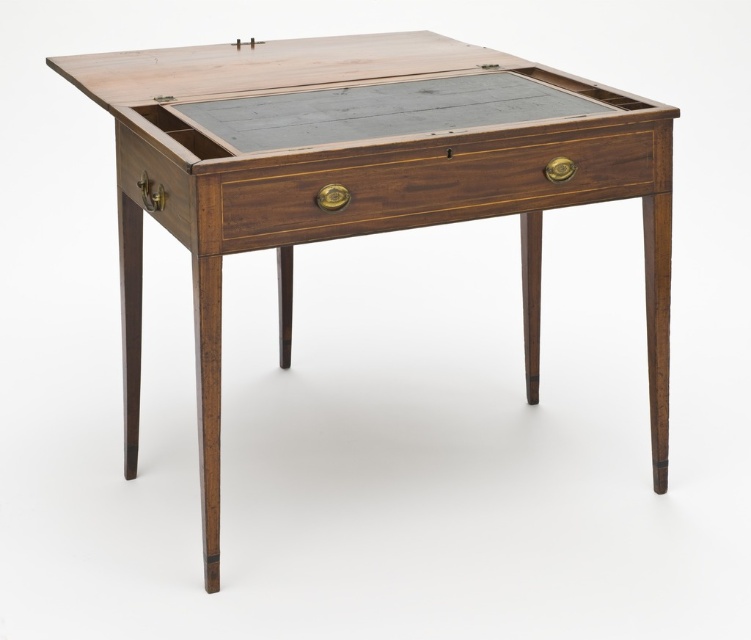
You are organizing your desk and need to place a 12 inch ruler between the mahogany drawer at center and the mahogany wood drawer at left. Can the ruler fit between them without overlapping either drawer?

The distance between the mahogany drawer at center and mahogany wood drawer at left is 11.52 inches, which is less than the 12 inch ruler. Therefore, the ruler cannot fit between them without overlapping either drawer.

You are organizing a small antique shop and need to place a 25 cm wide decorative vase between the mahogany wood table at center and the mahogany wood drawer at left. Will there be enough space for the vase between them?

The distance between the mahogany wood table at center and the mahogany wood drawer at left is 26.58 centimeters. Since the vase is 25 cm wide, there will be enough space as 26.58 cm is greater than 25 cm.

In the scene shown: You are standing in front of the vintage wooden writing desk. You want to place a pen on the mahogany wood table at center and then open the mahogany wood drawer at left. Which object should you interact with first based on their positions?

The mahogany wood table at center is closer to the viewer than the mahogany wood drawer at left, so you should place the pen on the mahogany wood table at center first before reaching for the mahogany wood drawer at left.